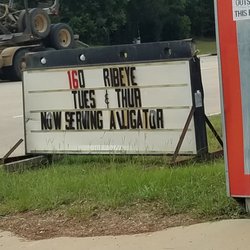
Where is `brackets`? Image resolution: width=250 pixels, height=250 pixels. brackets is located at coordinates (213, 129), (183, 126), (14, 144).